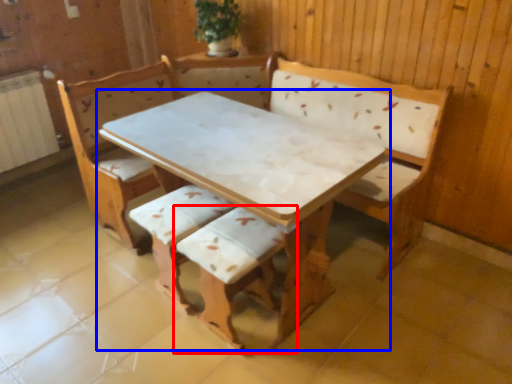
Question: Among these objects, which one is nearest to the camera, armchair (highlighted by a red box) or table (highlighted by a blue box)?

Choices:
 (A) armchair
 (B) table

Answer: (B)